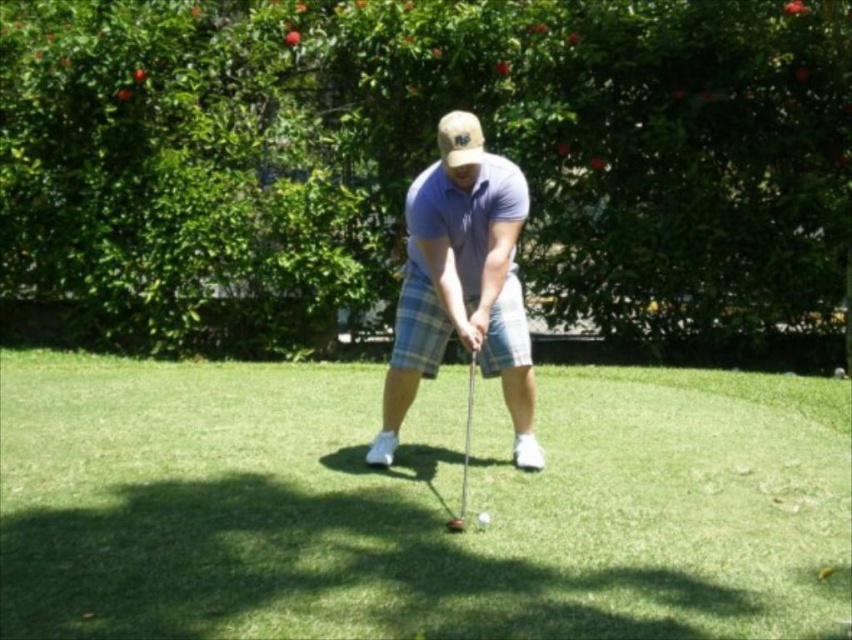
You are a golfer standing at point (486, 515) and want to hit the ball to the hole located at point (677, 541). Based on the scene description, will the dense bushes and trees with vibrant red flowers block your direct line of sight to the hole?

Point (677, 541) is in front of point (486, 515), so the dense bushes and trees with vibrant red flowers in the background would not block the direct line of sight between the golfer and the hole.

You are a photographer capturing the golfer from the front. You want to place two markers at point (x=463, y=468) and point (x=481, y=518). Which point will appear closer to the camera in the photo?

Point (x=481, y=518) will appear closer to the camera because it is physically closer to the photographer than point (x=463, y=468), which is further away.

Based on the scene description, which object is bigger between the green grass at center and the shiny silver golf ball at center?

The green grass at center is larger in size compared to the shiny silver golf ball at center.